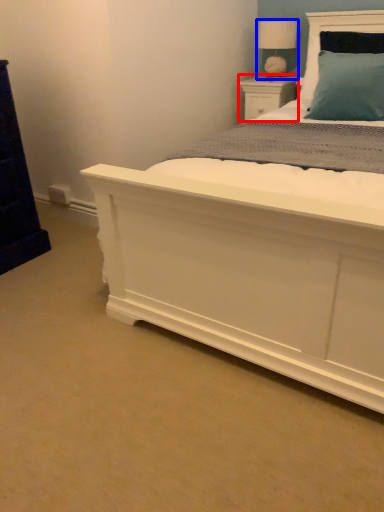
Question: Which object appears closest to the camera in this image, nightstand (highlighted by a red box) or table lamp (highlighted by a blue box)?

Choices:
 (A) nightstand
 (B) table lamp

Answer: (B)